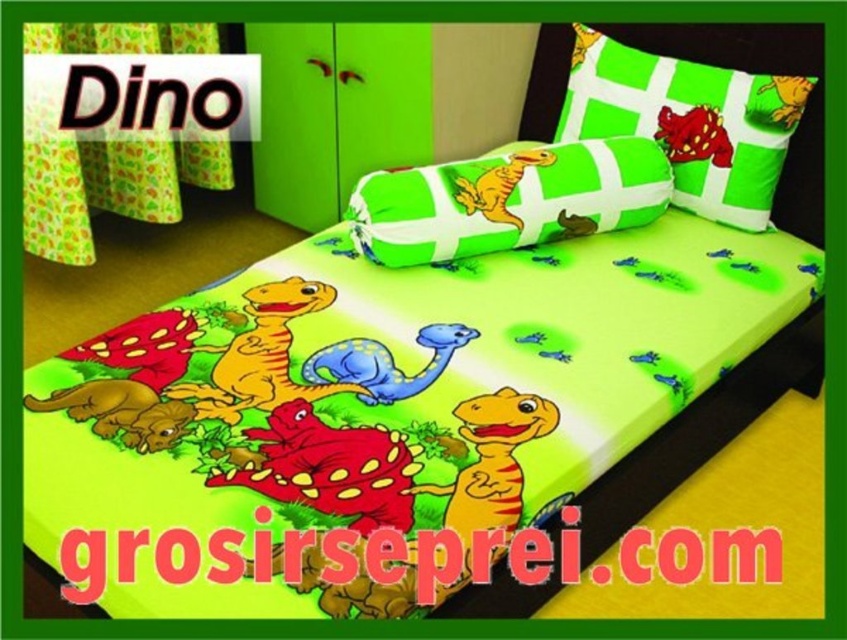
Question: Does matte yellow dinosaur at center have a smaller size compared to brown matte dinosaur at center?

Choices:
 (A) yes
 (B) no

Answer: (B)

Question: Which object is the farthest from the smooth red dinosaur at center?

Choices:
 (A) brown matte dinosaur at lower left
 (B) green fabric pillow at center

Answer: (B)

Question: Which object appears closest to the camera in this image?

Choices:
 (A) green fabric pillow at center
 (B) green fabric pillow with dinosaur prints at upper center

Answer: (A)

Question: Which object is positioned closest to the smooth red dinosaur at center?

Choices:
 (A) blue rubber dinosaur at center
 (B) brown matte dinosaur at center

Answer: (A)

Question: Does green fabric pillow with dinosaur prints at upper center appear on the right side of brown matte dinosaur at center?

Choices:
 (A) no
 (B) yes

Answer: (B)

Question: Is green fabric pillow with dinosaur prints at upper center below green fabric pillow at center?

Choices:
 (A) yes
 (B) no

Answer: (B)